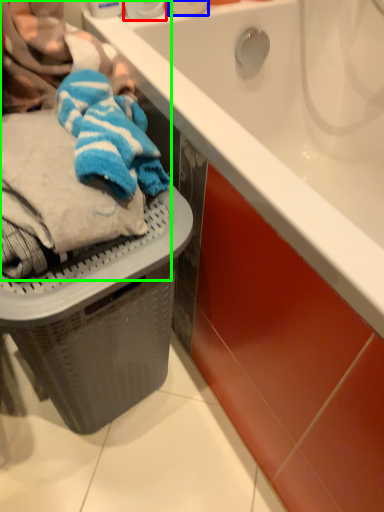
Question: Which object is the closest to the toiletry (highlighted by a red box)? Choose among these: toiletry (highlighted by a blue box) or laundry (highlighted by a green box).

Choices:
 (A) toiletry
 (B) laundry

Answer: (A)